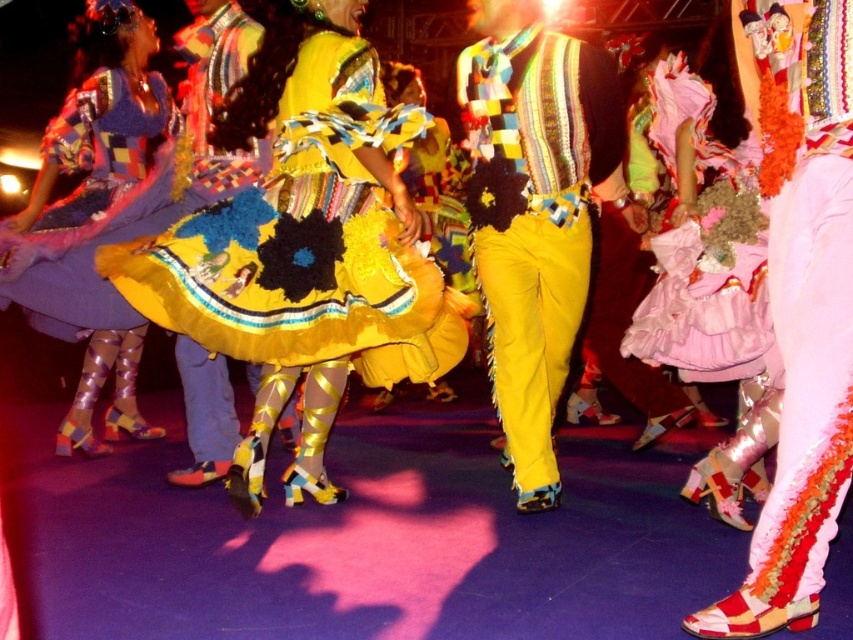
Between yellow textured fabric dress at center and yellow textured pants at center, which one has more height?

With more height is yellow textured pants at center.

Can you confirm if yellow textured fabric dress at center is shorter than yellow textured pants at center?

Indeed, yellow textured fabric dress at center has a lesser height compared to yellow textured pants at center.

Is point (346, 355) in front of point (563, 256)?

Yes.

This screenshot has width=853, height=640. Identify the location of yellow textured fabric dress at center. pyautogui.click(x=306, y=243).

Does point (508, 291) come in front of point (132, 360)?

Yes.

Is the position of yellow textured pants at center less distant than that of shiny metallic boots at lower left?

Yes.

Which is in front, point (488, 106) or point (59, 337)?

Point (488, 106) is in front.

I want to click on yellow textured pants at center, so click(535, 220).

Who is taller, yellow textured fabric dress at center or shiny metallic boots at lower left?

shiny metallic boots at lower left is taller.

Can you confirm if yellow textured fabric dress at center is taller than shiny metallic boots at lower left?

In fact, yellow textured fabric dress at center may be shorter than shiny metallic boots at lower left.

The height and width of the screenshot is (640, 853). I want to click on yellow textured fabric dress at center, so click(x=306, y=243).

Locate an element on the screen. The width and height of the screenshot is (853, 640). yellow textured fabric dress at center is located at coordinates (306, 243).